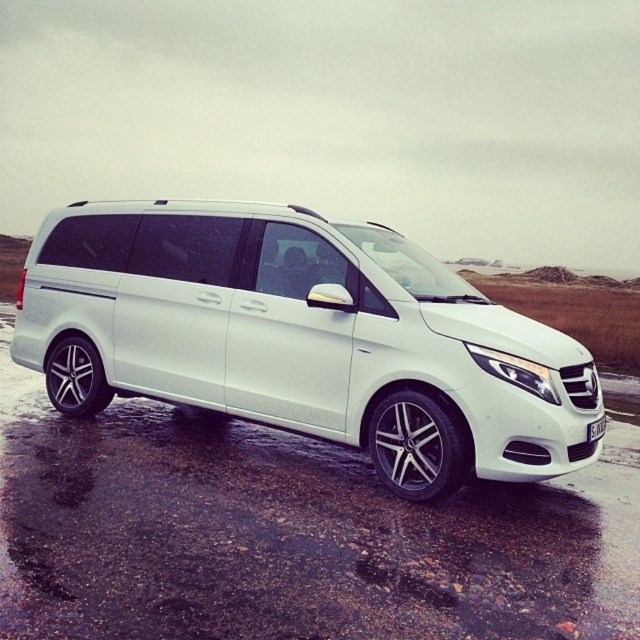
You are standing at the point marked by coordinates point (301,337) in the image. What object are you directly facing?

The point marked by coordinates point (301,337) marks white metallic van at center, so you are directly facing the white metallic van at center.

You are a delivery driver who needs to attach a new license plate to your white metallic van at center. The current white plastic license plate at lower right is damaged and needs replacement. Based on the image, where should the new license plate be positioned relative to the van?

The white plastic license plate at lower right should be positioned below the white metallic van at center, as the van is above the license plate in the image.